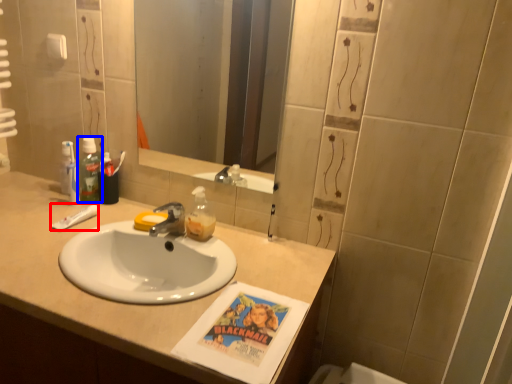
Question: Among these objects, which one is farthest to the camera, toothpaste (highlighted by a red box) or mouthwash (highlighted by a blue box)?

Choices:
 (A) toothpaste
 (B) mouthwash

Answer: (B)